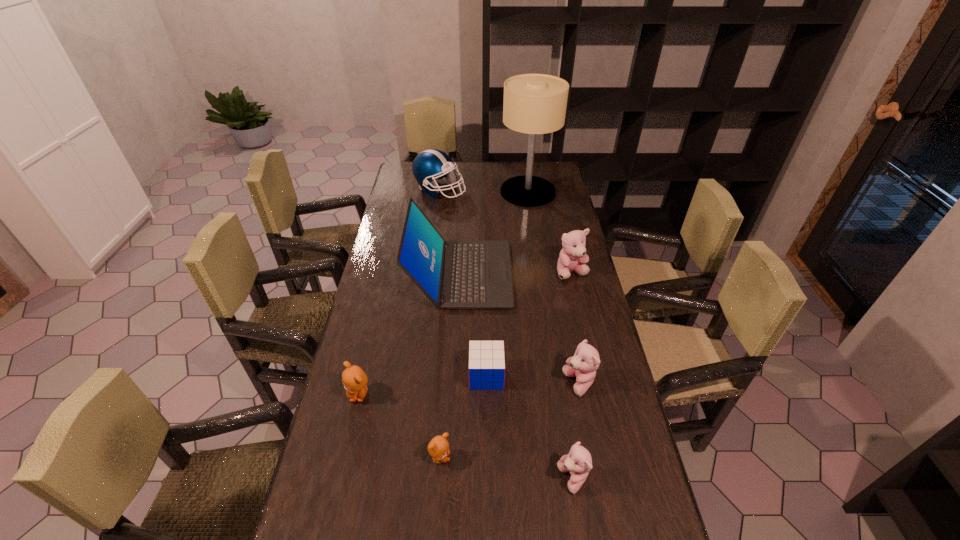
In order to click on the nearest pink teddy bear in this screenshot , I will do `click(578, 462)`.

Where is `cube`? This screenshot has width=960, height=540. cube is located at coordinates (486, 358).

Locate an element on the screen. This screenshot has width=960, height=540. the smaller brown teddy bear is located at coordinates (438, 447).

Locate an element on the screen. The image size is (960, 540). the right brown teddy bear is located at coordinates (438, 447).

The width and height of the screenshot is (960, 540). What are the coordinates of `free space located on the back of the beige table lamp` in the screenshot? It's located at (524, 166).

The width and height of the screenshot is (960, 540). I want to click on vacant area situated on the screen of the gray laptop computer, so click(x=547, y=274).

Find the location of `vacant space situated at the front of the football helmet with the faceguard`. vacant space situated at the front of the football helmet with the faceguard is located at coordinates (534, 190).

I want to click on free region located 0.230m at the face of the farthest pink teddy bear, so click(x=587, y=332).

Locate an element on the screen. This screenshot has width=960, height=540. free space located 0.400m at the face of the fourth shortest teddy bear is located at coordinates (422, 384).

I want to click on free region located 0.300m at the face of the fourth shortest teddy bear, so click(x=457, y=384).